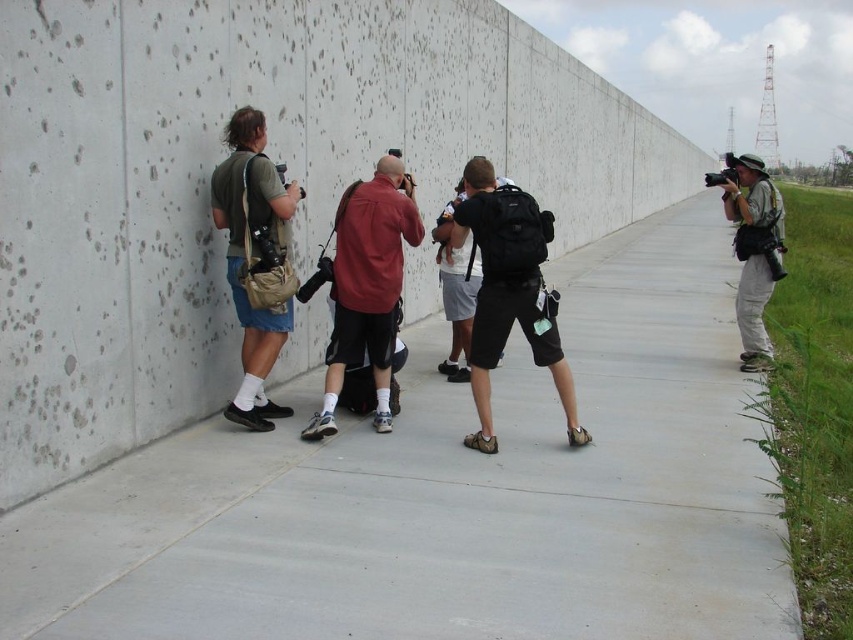
Question: Is gray concrete pavement at center to the left of matte khaki shorts at left from the viewer's perspective?

Choices:
 (A) no
 (B) yes

Answer: (A)

Question: Is matte red shirt at center bigger than black matte backpack at center?

Choices:
 (A) no
 (B) yes

Answer: (B)

Question: Can you confirm if matte khaki shorts at left is bigger than matte red shirt at center?

Choices:
 (A) no
 (B) yes

Answer: (A)

Question: Which point is closer to the camera taking this photo?

Choices:
 (A) (766, 208)
 (B) (555, 624)

Answer: (B)

Question: Which object is the closest to the matte red shirt at center?

Choices:
 (A) black matte backpack at center
 (B) gray concrete wall at center

Answer: (A)

Question: Which point is farther to the camera?

Choices:
 (A) (505, 330)
 (B) (413, 573)
 (C) (746, 198)

Answer: (C)